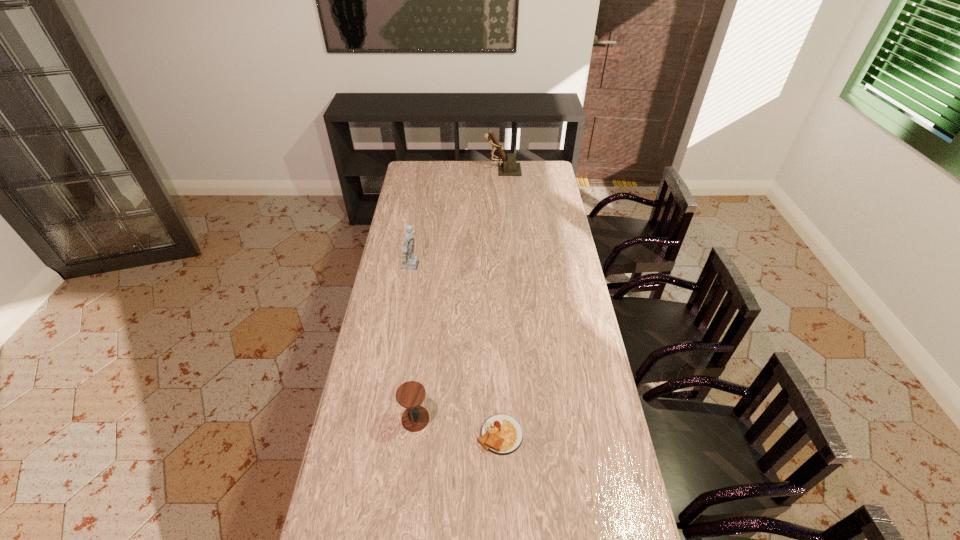
Where is `the farther figurine`? This screenshot has height=540, width=960. the farther figurine is located at coordinates (509, 167).

At what (x,y) coordinates should I click in order to perform the action: click on the right figurine. Please return your answer as a coordinate pair (x, y). Looking at the image, I should click on (509, 167).

Locate an element on the screen. the nearer figurine is located at coordinates (409, 261).

Identify the location of the second farthest object. This screenshot has width=960, height=540. (409, 261).

This screenshot has width=960, height=540. I want to click on the third tallest object, so click(411, 394).

What are the coordinates of `the shortest object` in the screenshot? It's located at pos(501,434).

Locate an element on the screen. The height and width of the screenshot is (540, 960). free spot located 0.150m on the front-facing side of the farther figurine is located at coordinates (458, 170).

Image resolution: width=960 pixels, height=540 pixels. Identify the location of free spot located on the front-facing side of the farther figurine. (434, 170).

Where is `vacant area situated on the front-facing side of the farther figurine`? This screenshot has height=540, width=960. vacant area situated on the front-facing side of the farther figurine is located at coordinates (454, 170).

Where is `free location located 0.290m on the front-facing side of the nearer figurine`? free location located 0.290m on the front-facing side of the nearer figurine is located at coordinates (489, 267).